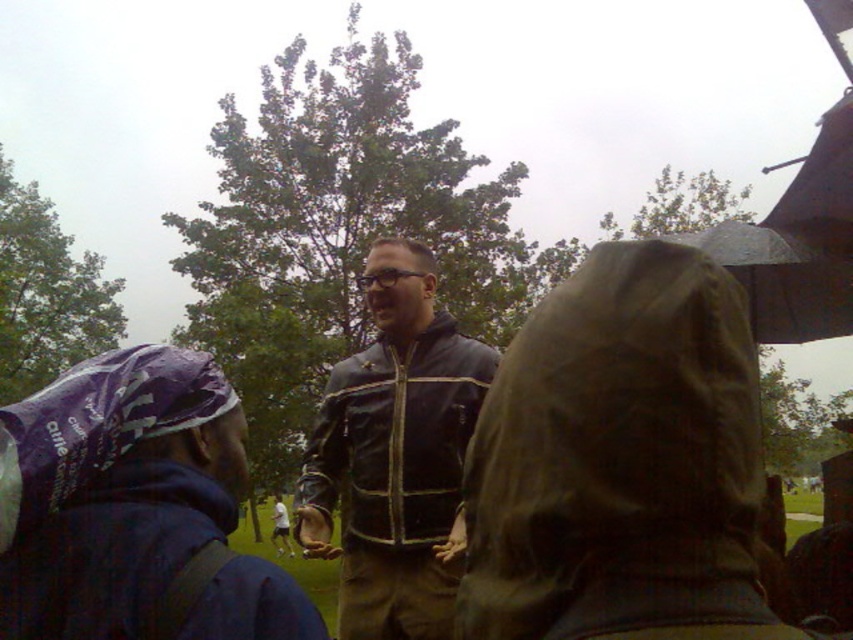
Is leather jacket at center closer to the viewer compared to transparent plastic umbrella at upper right?

Yes, it is.

Can you confirm if leather jacket at center is thinner than transparent plastic umbrella at upper right?

Correct, leather jacket at center's width is less than transparent plastic umbrella at upper right's.

This screenshot has height=640, width=853. What do you see at coordinates (395, 454) in the screenshot?
I see `leather jacket at center` at bounding box center [395, 454].

Locate an element on the screen. The image size is (853, 640). leather jacket at center is located at coordinates (395, 454).

Does brown corduroy raincoat at center have a lesser width compared to leather jacket at center?

Yes, brown corduroy raincoat at center is thinner than leather jacket at center.

Is brown corduroy raincoat at center bigger than leather jacket at center?

No.

Identify the location of brown corduroy raincoat at center. (621, 461).

Does purple fabric bandana at left lie in front of transparent plastic umbrella at upper right?

Yes, purple fabric bandana at left is closer to the viewer.

Does purple fabric bandana at left appear on the right side of transparent plastic umbrella at upper right?

In fact, purple fabric bandana at left is to the left of transparent plastic umbrella at upper right.

Which is behind, point (299, 614) or point (711, 234)?

The point (711, 234) is behind.

Image resolution: width=853 pixels, height=640 pixels. Find the location of `purple fabric bandana at left`. purple fabric bandana at left is located at coordinates (134, 508).